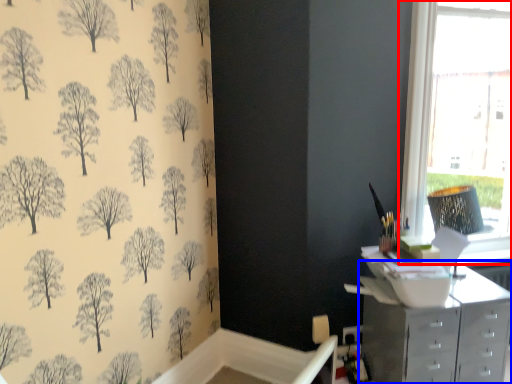
Question: Which of the following is the farthest to the observer, window (highlighted by a red box) or chest of drawers (highlighted by a blue box)?

Choices:
 (A) window
 (B) chest of drawers

Answer: (A)